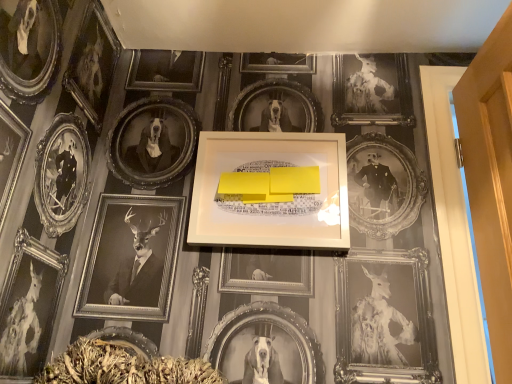
Question: Should I look upward or downward to see white matte picture frame at center?

Choices:
 (A) down
 (B) up

Answer: (B)